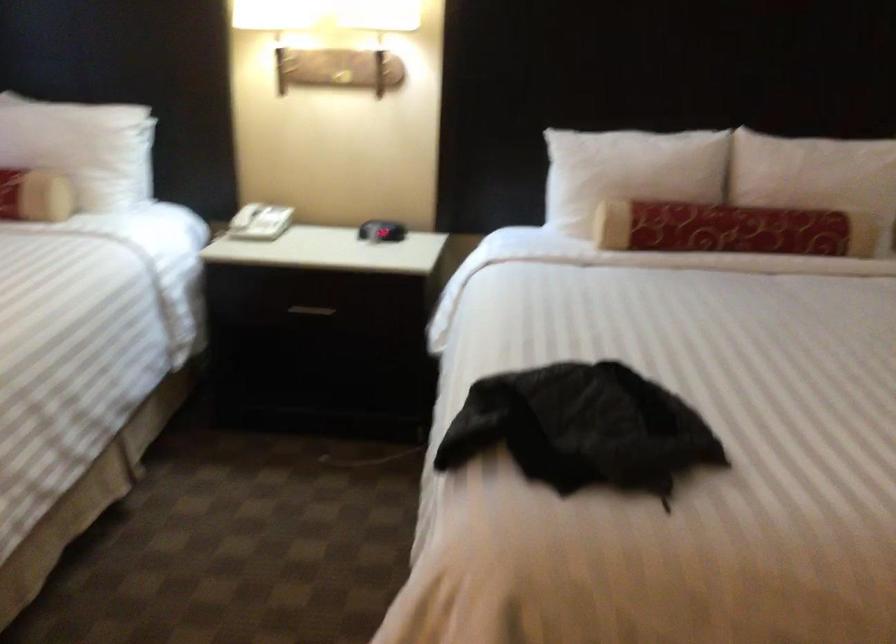
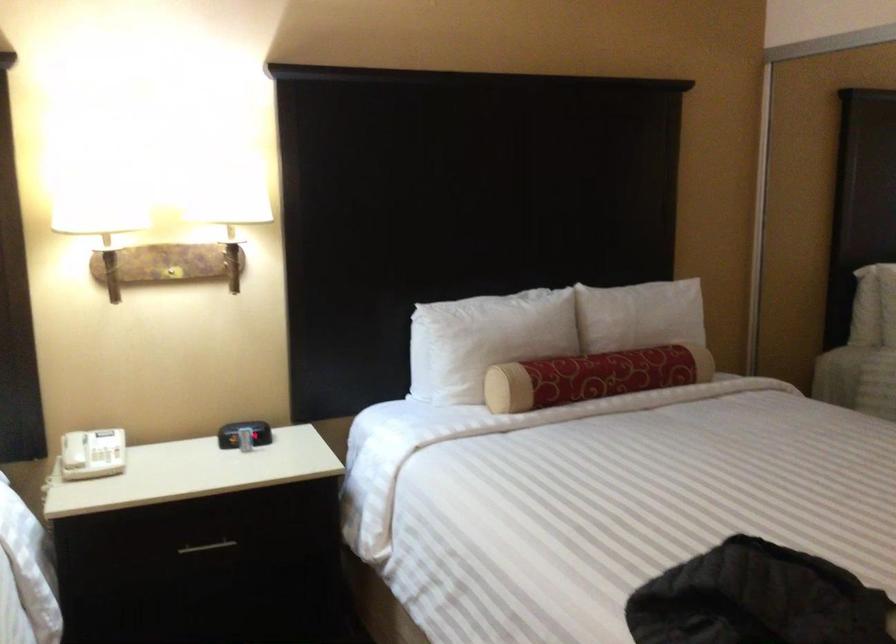
Find the pixel in the second image that matches (x=606, y=171) in the first image.

(485, 339)